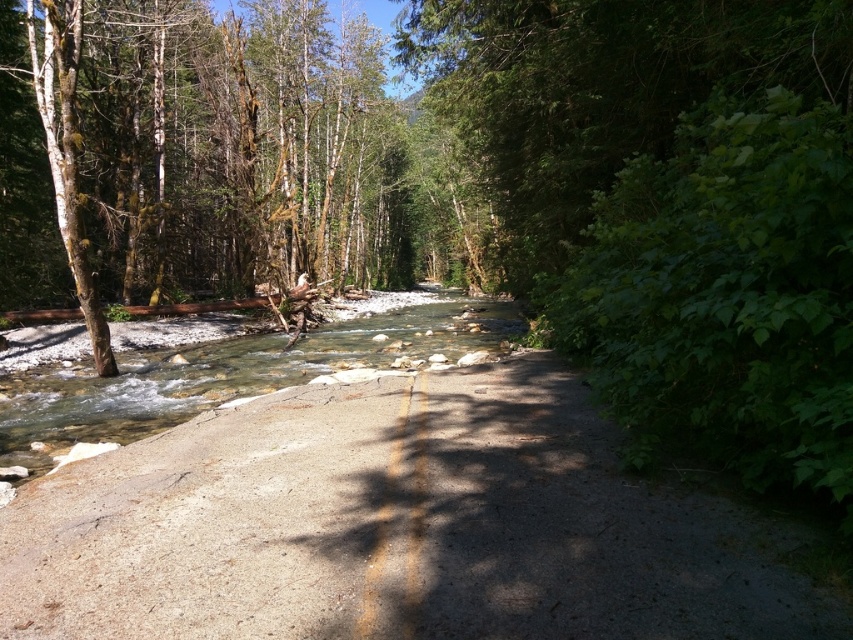
Looking at this image, can you confirm if gray concrete road at center is positioned to the right of green mossy tree at left?

Yes, gray concrete road at center is to the right of green mossy tree at left.

Is the position of gray concrete road at center more distant than that of green mossy tree at left?

That is False.

Find the location of a particular element. gray concrete road at center is located at coordinates (393, 528).

The image size is (853, 640). Identify the location of gray concrete road at center. (393, 528).

Who is taller, gray concrete road at center or clear water at center?

clear water at center

Can you confirm if gray concrete road at center is positioned above clear water at center?

Actually, gray concrete road at center is below clear water at center.

Between point (228, 492) and point (212, 362), which one is positioned in front?

Positioned in front is point (228, 492).

Image resolution: width=853 pixels, height=640 pixels. I want to click on gray concrete road at center, so [393, 528].

Is green mossy tree at left thinner than clear water at center?

No, green mossy tree at left is not thinner than clear water at center.

Consider the image. Can you confirm if green mossy tree at left is taller than clear water at center?

Yes, green mossy tree at left is taller than clear water at center.

Between point (141, 273) and point (331, 344), which one is positioned in front?

Point (331, 344) is more forward.

Where is `green mossy tree at left`? The height and width of the screenshot is (640, 853). green mossy tree at left is located at coordinates (196, 141).